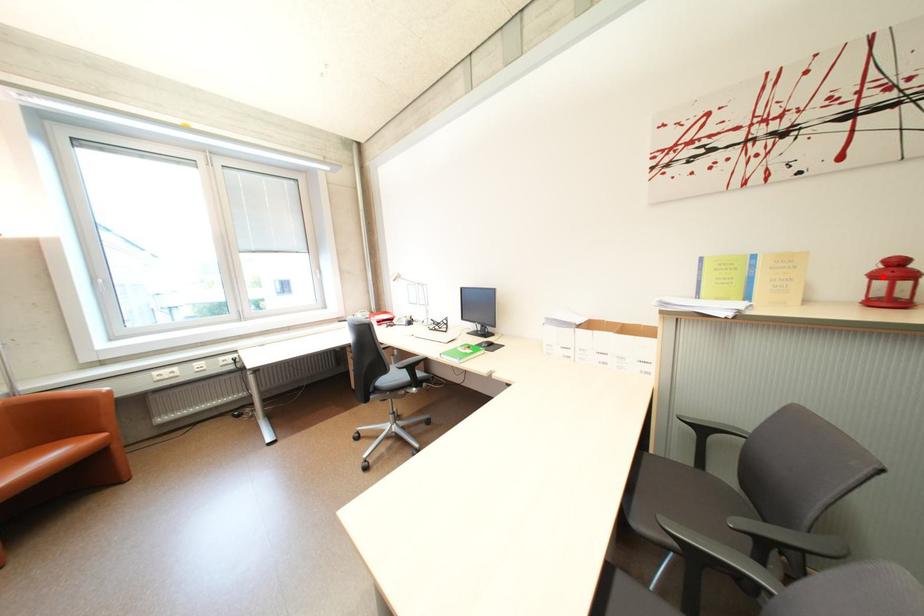
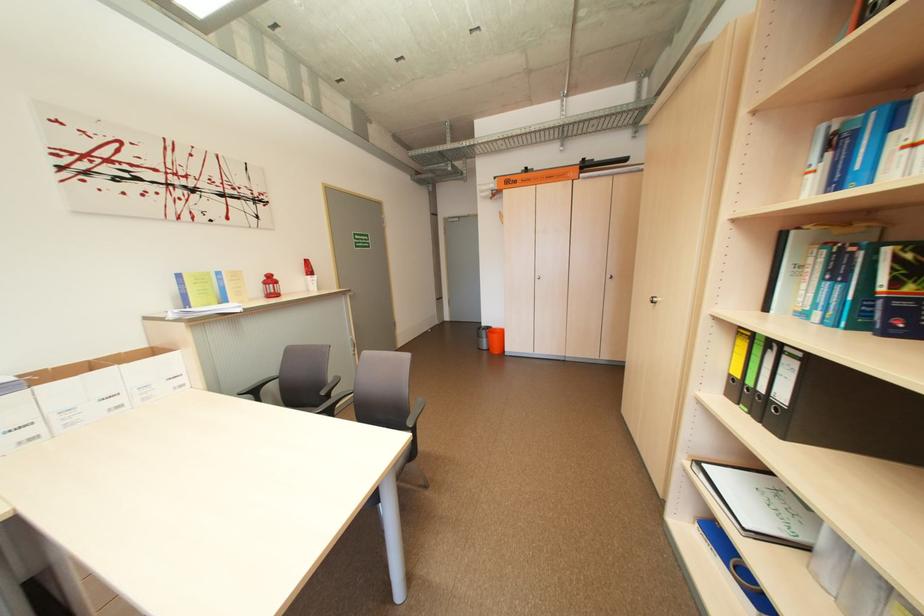
Where in the second image is the point corresponding to the highlighted location from the first image?

(274, 284)